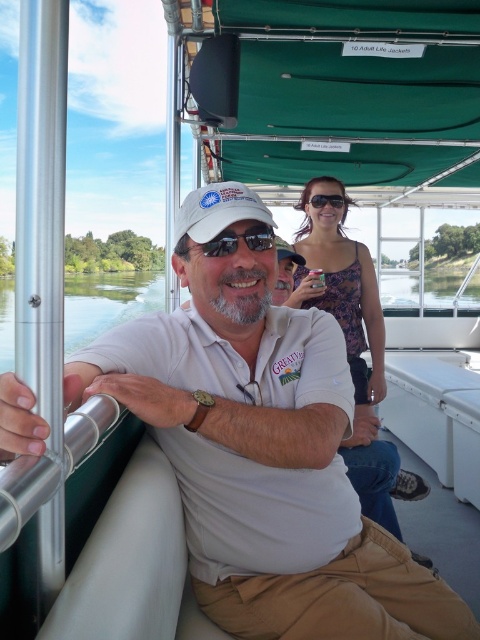
Question: Which of the following is the farthest from the observer?

Choices:
 (A) floral fabric dress at center
 (B) sunglasses at center

Answer: (A)

Question: In this image, where is sunglasses at center located relative to matte black sunglasses at upper center?

Choices:
 (A) below
 (B) above

Answer: (A)

Question: Which object is the farthest from the floral fabric dress at center?

Choices:
 (A) sunglasses at center
 (B) matte black sunglasses at upper center

Answer: (A)

Question: Considering the real-world distances, which object is farthest from the matte black sunglasses at upper center?

Choices:
 (A) sunglasses at center
 (B) floral fabric dress at center

Answer: (A)

Question: Is sunglasses at center bigger than matte black sunglasses at upper center?

Choices:
 (A) no
 (B) yes

Answer: (A)

Question: Where is floral fabric dress at center located in relation to sunglasses at center in the image?

Choices:
 (A) above
 (B) below

Answer: (B)